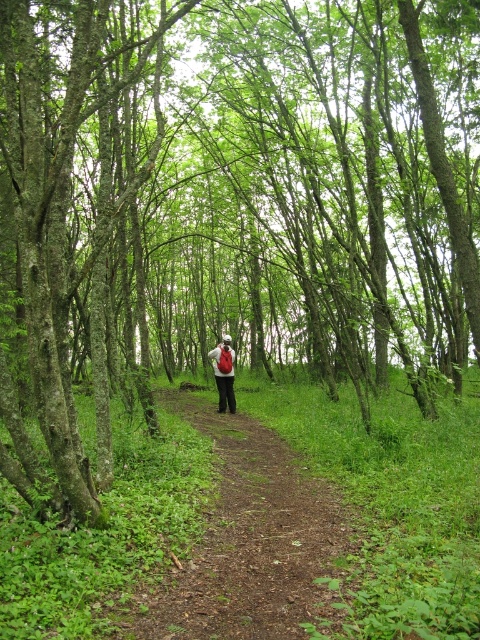
Who is positioned more to the left, brown dirt path at center or matte red backpack at center?

Positioned to the left is matte red backpack at center.

Who is more forward, (285, 570) or (223, 362)?

Point (285, 570) is in front.

Locate an element on the screen. brown dirt path at center is located at coordinates (250, 541).

Locate an element on the screen. The width and height of the screenshot is (480, 640). brown dirt path at center is located at coordinates (250, 541).